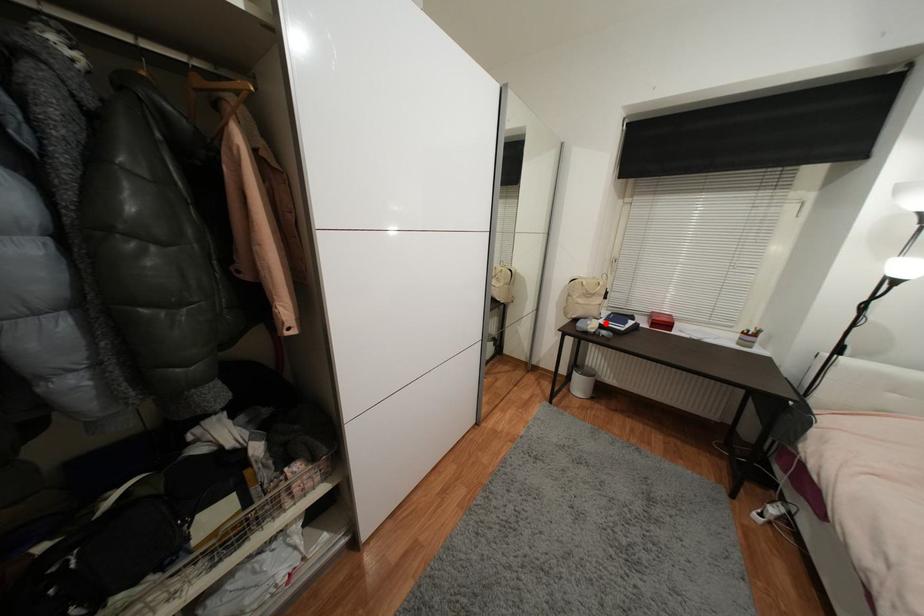
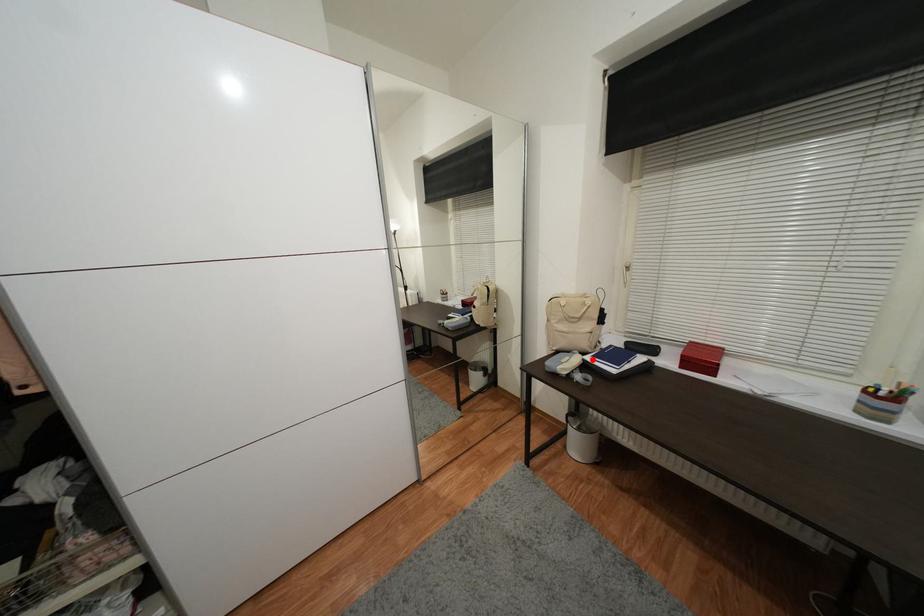
I am providing you with two images of the same scene from different viewpoints. A red point is marked on the first image and another point is marked on the second image. Is the red point in image1 aligned with the point shown in image2?

Yes